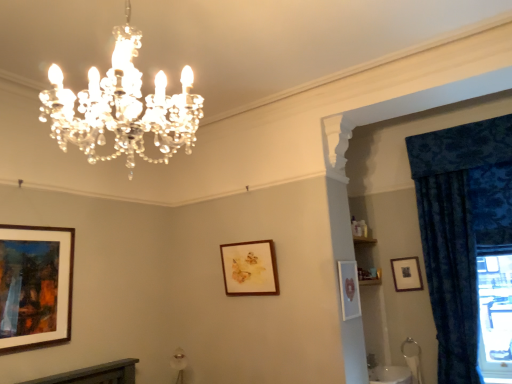
Where is `wooden-framed painting at left, which ranks as the 4th picture frame in back-to-front order`? wooden-framed painting at left, which ranks as the 4th picture frame in back-to-front order is located at coordinates (35, 285).

Find the location of a particular element. wooden picture frame at center, the second picture frame from the back is located at coordinates (249, 268).

The image size is (512, 384). I want to click on clear crystal chandelier at upper center, so click(122, 107).

Considering the sizes of objects wooden picture frame at center, the second picture frame from the back, and matte white picture frame at center-right, the second picture frame viewed from the front, in the image provided, who is shorter, wooden picture frame at center, the second picture frame from the back, or matte white picture frame at center-right, the second picture frame viewed from the front,?

wooden picture frame at center, the second picture frame from the back.

In terms of width, does wooden picture frame at center, the second picture frame from the back, look wider or thinner when compared to matte white picture frame at center-right, the second picture frame viewed from the front?

Considering their sizes, wooden picture frame at center, the second picture frame from the back, looks broader than matte white picture frame at center-right, the second picture frame viewed from the front.

Is point (262, 276) in front of point (354, 268)?

No, it is not.

Could you tell me if clear crystal chandelier at upper center is turned towards wooden picture frame at center, the second picture frame from the back?

No, clear crystal chandelier at upper center is not aimed at wooden picture frame at center, the second picture frame from the back.

Can you tell me how much clear crystal chandelier at upper center and wooden picture frame at center, the second picture frame from the back, differ in facing direction?

There is a 91.6-degree angle between the facing directions of clear crystal chandelier at upper center and wooden picture frame at center, the second picture frame from the back.

Considering the relative sizes of clear crystal chandelier at upper center and wooden picture frame at center, the second picture frame from the back, in the image provided, is clear crystal chandelier at upper center taller than wooden picture frame at center, the second picture frame from the back,?

Yes.

Is wooden picture frame at upper right, acting as the 1th picture frame starting from the back, directly adjacent to wooden picture frame at center, which is counted as the 3th picture frame, starting from the front?

wooden picture frame at upper right, acting as the 1th picture frame starting from the back, and wooden picture frame at center, which is counted as the 3th picture frame, starting from the front, are clearly separated.

From the image's perspective, is wooden picture frame at upper right, which is the 1th picture frame in right-to-left order, located above wooden picture frame at center, the 3th picture frame from the right?

No.

Does wooden picture frame at upper right, which is the 4th picture frame from left to right, have a greater width compared to wooden picture frame at center, which is counted as the 2th picture frame, starting from the left?

In fact, wooden picture frame at upper right, which is the 4th picture frame from left to right, might be narrower than wooden picture frame at center, which is counted as the 2th picture frame, starting from the left.

Consider the image. Does wooden picture frame at upper right, acting as the 1th picture frame starting from the back, have a lesser height compared to wooden picture frame at center, which is counted as the 2th picture frame, starting from the left?

Yes.

From a real-world perspective, between wooden-framed painting at left, the first picture frame viewed from the left, and matte white picture frame at center-right, the second picture frame viewed from the front, who is vertically lower?

matte white picture frame at center-right, the second picture frame viewed from the front, is physically lower.

Are wooden-framed painting at left, the first picture frame viewed from the left, and matte white picture frame at center-right, positioned as the second picture frame in right-to-left order, located far from each other?

Yes, wooden-framed painting at left, the first picture frame viewed from the left, and matte white picture frame at center-right, positioned as the second picture frame in right-to-left order, are located far from each other.

From the image's perspective, who appears lower, wooden-framed painting at left, the first picture frame viewed from the left, or matte white picture frame at center-right, positioned as the second picture frame in right-to-left order?

matte white picture frame at center-right, positioned as the second picture frame in right-to-left order, appears lower in the image.

Do you think wooden-framed painting at left, which ranks as the 4th picture frame in back-to-front order, is within matte white picture frame at center-right, acting as the 3th picture frame starting from the left, or outside of it?

wooden-framed painting at left, which ranks as the 4th picture frame in back-to-front order, lies outside matte white picture frame at center-right, acting as the 3th picture frame starting from the left.

Is velvet blue curtain at right placed right next to matte white picture frame at center-right, acting as the 3th picture frame starting from the left?

No.

In the image, is velvet blue curtain at right positioned in front of or behind matte white picture frame at center-right, positioned as the second picture frame in right-to-left order?

Visually, velvet blue curtain at right is located behind matte white picture frame at center-right, positioned as the second picture frame in right-to-left order.

Is velvet blue curtain at right aimed at matte white picture frame at center-right, positioned as the 3th picture frame in back-to-front order?

No, velvet blue curtain at right is not facing towards matte white picture frame at center-right, positioned as the 3th picture frame in back-to-front order.

Would you say velvet blue curtain at right is inside or outside matte white picture frame at center-right, acting as the 3th picture frame starting from the left?

velvet blue curtain at right exists outside the volume of matte white picture frame at center-right, acting as the 3th picture frame starting from the left.

Considering the sizes of objects wooden picture frame at upper right, positioned as the fourth picture frame in front-to-back order, and clear crystal chandelier at upper center in the image provided, who is wider, wooden picture frame at upper right, positioned as the fourth picture frame in front-to-back order, or clear crystal chandelier at upper center?

Wider between the two is clear crystal chandelier at upper center.

Would you consider wooden picture frame at upper right, which is the 1th picture frame in right-to-left order, to be distant from clear crystal chandelier at upper center?

That's right, there is a large distance between wooden picture frame at upper right, which is the 1th picture frame in right-to-left order, and clear crystal chandelier at upper center.

Is wooden picture frame at upper right, which is the 1th picture frame in right-to-left order, oriented away from clear crystal chandelier at upper center?

wooden picture frame at upper right, which is the 1th picture frame in right-to-left order, is not turned away from clear crystal chandelier at upper center.

Is wooden picture frame at upper right, which is the 4th picture frame from left to right, bigger or smaller than clear crystal chandelier at upper center?

wooden picture frame at upper right, which is the 4th picture frame from left to right, is smaller than clear crystal chandelier at upper center.

Is matte white picture frame at center-right, positioned as the second picture frame in right-to-left order, surrounded by wooden picture frame at upper right, which is the 1th picture frame in right-to-left order?

No, wooden picture frame at upper right, which is the 1th picture frame in right-to-left order, does not contain matte white picture frame at center-right, positioned as the second picture frame in right-to-left order.

Which of these two, wooden picture frame at upper right, which is the 1th picture frame in right-to-left order, or matte white picture frame at center-right, positioned as the 3th picture frame in back-to-front order, stands shorter?

Standing shorter between the two is wooden picture frame at upper right, which is the 1th picture frame in right-to-left order.

Considering the positions of points (395, 260) and (348, 318), is point (395, 260) farther from camera compared to point (348, 318)?

Yes.

Between wooden picture frame at upper right, positioned as the fourth picture frame in front-to-back order, and matte white picture frame at center-right, positioned as the 3th picture frame in back-to-front order, which one has smaller size?

Smaller between the two is wooden picture frame at upper right, positioned as the fourth picture frame in front-to-back order.

In order to click on picture frame that is the 1st object located above the matte white picture frame at center-right, positioned as the 3th picture frame in back-to-front order (from the image's perspective) in this screenshot , I will do `click(249, 268)`.

You are a GUI agent. You are given a task and a screenshot of the screen. Output one action in this format:
    pyautogui.click(x=<x>, y=<y>)
    Task: Click on the 3rd picture frame behind the clear crystal chandelier at upper center
    
    Given the screenshot: What is the action you would take?
    pyautogui.click(x=249, y=268)

From the image, which object appears to be farther from matte white picture frame at center-right, positioned as the 3th picture frame in back-to-front order, wooden-framed painting at left, which ranks as the 4th picture frame in back-to-front order, or clear crystal chandelier at upper center?

wooden-framed painting at left, which ranks as the 4th picture frame in back-to-front order, is positioned further to the anchor matte white picture frame at center-right, positioned as the 3th picture frame in back-to-front order.

Which object lies nearer to the anchor point wooden picture frame at upper right, positioned as the fourth picture frame in front-to-back order, velvet blue curtain at right or wooden picture frame at center, the 3th picture frame from the right?

Among the two, velvet blue curtain at right is located nearer to wooden picture frame at upper right, positioned as the fourth picture frame in front-to-back order.

When comparing their distances from clear crystal chandelier at upper center, does velvet blue curtain at right or matte white picture frame at center-right, positioned as the second picture frame in right-to-left order, seem further?

Based on the image, velvet blue curtain at right appears to be further to clear crystal chandelier at upper center.

Which object lies nearer to the anchor point wooden picture frame at upper right, positioned as the fourth picture frame in front-to-back order, clear crystal chandelier at upper center or velvet blue curtain at right?

The object closer to wooden picture frame at upper right, positioned as the fourth picture frame in front-to-back order, is velvet blue curtain at right.

Considering their positions, is velvet blue curtain at right positioned further to wooden picture frame at upper right, acting as the 1th picture frame starting from the back, than wooden-framed painting at left, which ranks as the 4th picture frame in back-to-front order?

Based on the image, wooden-framed painting at left, which ranks as the 4th picture frame in back-to-front order, appears to be further to wooden picture frame at upper right, acting as the 1th picture frame starting from the back.

Looking at the image, which one is located closer to wooden picture frame at upper right, acting as the 1th picture frame starting from the back, velvet blue curtain at right or clear crystal chandelier at upper center?

velvet blue curtain at right.

Considering their positions, is wooden picture frame at upper right, which is the 1th picture frame in right-to-left order, positioned further to clear crystal chandelier at upper center than wooden-framed painting at left, which ranks as the 4th picture frame in back-to-front order?

wooden picture frame at upper right, which is the 1th picture frame in right-to-left order.

Considering their positions, is wooden picture frame at upper right, which is the 1th picture frame in right-to-left order, positioned further to velvet blue curtain at right than wooden picture frame at center, which is counted as the 2th picture frame, starting from the left?

wooden picture frame at center, which is counted as the 2th picture frame, starting from the left, is further to velvet blue curtain at right.

This screenshot has width=512, height=384. In order to click on lamp situated between wooden-framed painting at left, which ranks as the 4th picture frame in back-to-front order, and velvet blue curtain at right from left to right in this screenshot , I will do 122,107.

You are a GUI agent. You are given a task and a screenshot of the screen. Output one action in this format:
    pyautogui.click(x=<x>, y=<y>)
    Task: Click on the picture frame between wooden-framed painting at left, the first picture frame viewed from the left, and matte white picture frame at center-right, positioned as the 3th picture frame in back-to-front order, from left to right
    
    Given the screenshot: What is the action you would take?
    pyautogui.click(x=249, y=268)

The height and width of the screenshot is (384, 512). In order to click on picture frame situated between matte white picture frame at center-right, positioned as the 3th picture frame in back-to-front order, and velvet blue curtain at right from left to right in this screenshot , I will do `click(406, 274)`.

I want to click on curtain positioned between clear crystal chandelier at upper center and wooden picture frame at center, which is counted as the 3th picture frame, starting from the front, from near to far, so click(461, 228).